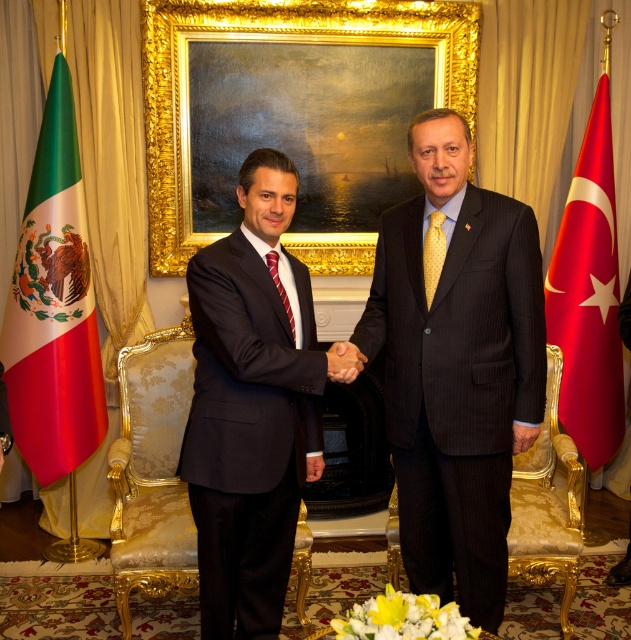
Question: Can you confirm if goldmaterial/texturepicture frame at upper center is thinner than red fabric flag at right?

Choices:
 (A) no
 (B) yes

Answer: (A)

Question: Which point appears closest to the camera in this image?

Choices:
 (A) (581, 195)
 (B) (433, 237)
 (C) (220, 541)

Answer: (C)

Question: Which of these objects is positioned closest to the red fabric flag at right?

Choices:
 (A) dark pinstripe suit at center
 (B) red fabric flag at left
 (C) yellow dotted tie at center

Answer: (A)

Question: Does dark pinstripe suit at center appear over black suit at center?

Choices:
 (A) no
 (B) yes

Answer: (B)

Question: Is black suit at center smaller than yellow dotted tie at center?

Choices:
 (A) no
 (B) yes

Answer: (A)

Question: Among these points, which one is farthest from the camera?

Choices:
 (A) (394, 237)
 (B) (251, 573)

Answer: (B)